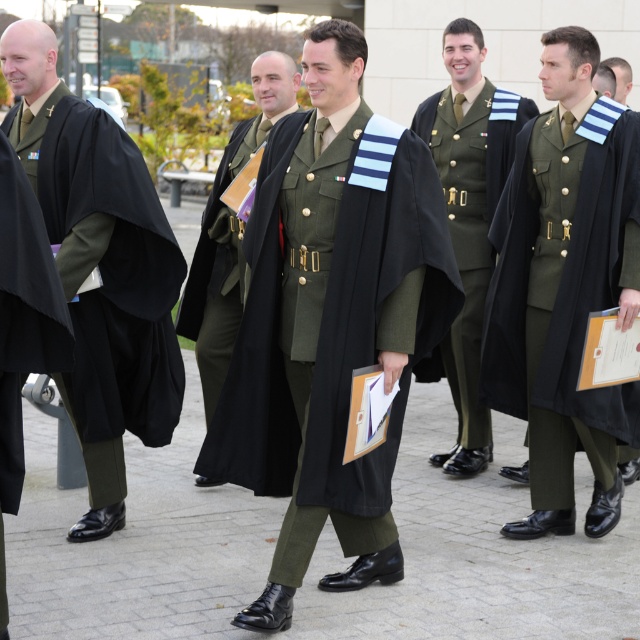
In the scene shown: Is black matte graduation gown at left positioned in front of green military uniform at center?

Yes, black matte graduation gown at left is closer to the viewer.

Between point (124, 317) and point (464, 353), which one is positioned in front?

Point (124, 317) is more forward.

This screenshot has height=640, width=640. Identify the location of black matte graduation gown at left. (99, 268).

Is matte black coat at center positioned at the back of matte black hair at upper right?

That is False.

Does matte black coat at center have a lesser width compared to matte black hair at upper right?

No.

Identify the location of matte black coat at center. (228, 234).

Can you confirm if matte black robe at center is positioned above black matte graduation gown at left?

No.

Between matte black robe at center and black matte graduation gown at left, which one is positioned higher?

black matte graduation gown at left is higher up.

Who is more distant from viewer, (528, 180) or (68, 192)?

Positioned behind is point (528, 180).

Image resolution: width=640 pixels, height=640 pixels. I want to click on matte black robe at center, so pyautogui.click(x=564, y=289).